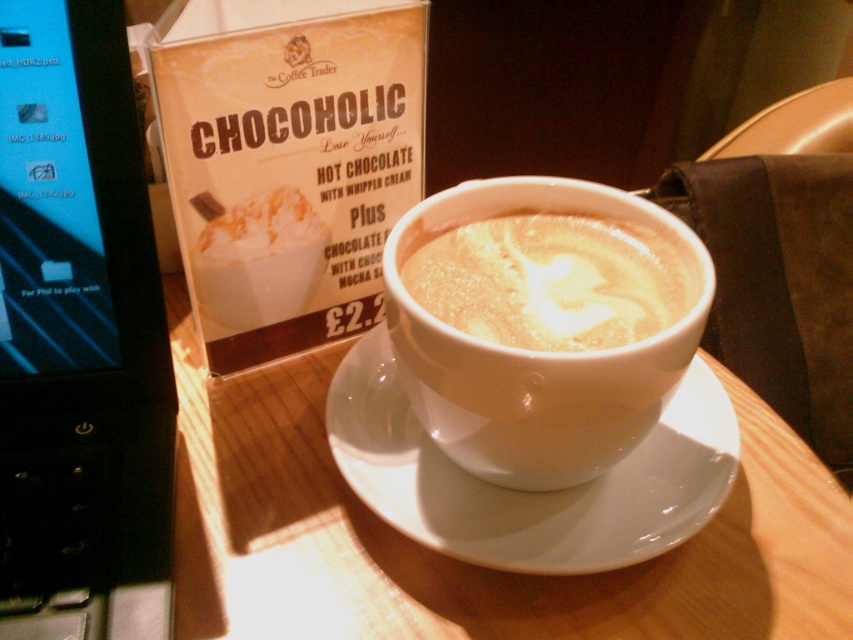
Question: Which of these objects is positioned closest to the white ceramic saucer at center?

Choices:
 (A) black plastic laptop at left
 (B) white glossy cup at center

Answer: (B)

Question: Which of these objects is positioned closest to the black plastic laptop at left?

Choices:
 (A) white frothy latte art at center
 (B) white glossy cup at center
 (C) white ceramic saucer at center

Answer: (C)

Question: In this image, where is black plastic laptop at left located relative to white ceramic saucer at center?

Choices:
 (A) left
 (B) right

Answer: (A)

Question: Which point is farther from the camera taking this photo?

Choices:
 (A) (471, 444)
 (B) (61, 204)
 (C) (538, 330)
 (D) (431, 481)

Answer: (D)

Question: Where is black plastic laptop at left located in relation to white glossy cup at center in the image?

Choices:
 (A) above
 (B) below

Answer: (B)

Question: Can you confirm if white glossy cup at center is wider than white frothy latte art at center?

Choices:
 (A) no
 (B) yes

Answer: (B)